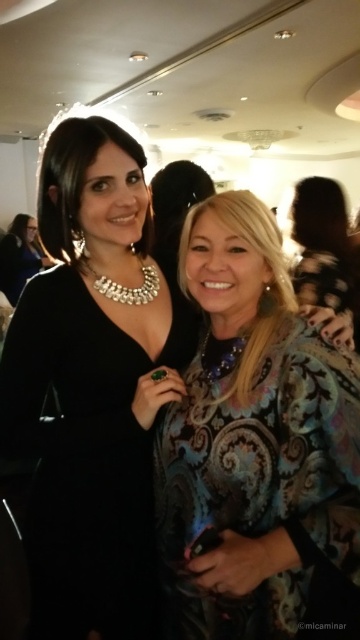
Is patterned fabric dress at center shorter than matte black dress at center?

Yes, patterned fabric dress at center is shorter than matte black dress at center.

Is patterned fabric dress at center thinner than matte black dress at center?

Yes.

I want to click on patterned fabric dress at center, so click(258, 477).

The height and width of the screenshot is (640, 360). In order to click on black velvet dress at center in this screenshot , I will do `click(86, 456)`.

Is point (144, 464) positioned in front of point (2, 259)?

Yes.

Does point (84, 442) lie in front of point (32, 228)?

Yes, point (84, 442) is closer to viewer.

Where is `black velvet dress at center`? black velvet dress at center is located at coordinates (86, 456).

Is point (241, 419) positioned in front of point (189, 349)?

Yes.

Which is in front, point (213, 499) or point (68, 612)?

Point (213, 499)

Find the location of a particular element. patterned fabric dress at center is located at coordinates (258, 477).

Identify the location of patterned fabric dress at center. The image size is (360, 640). (258, 477).